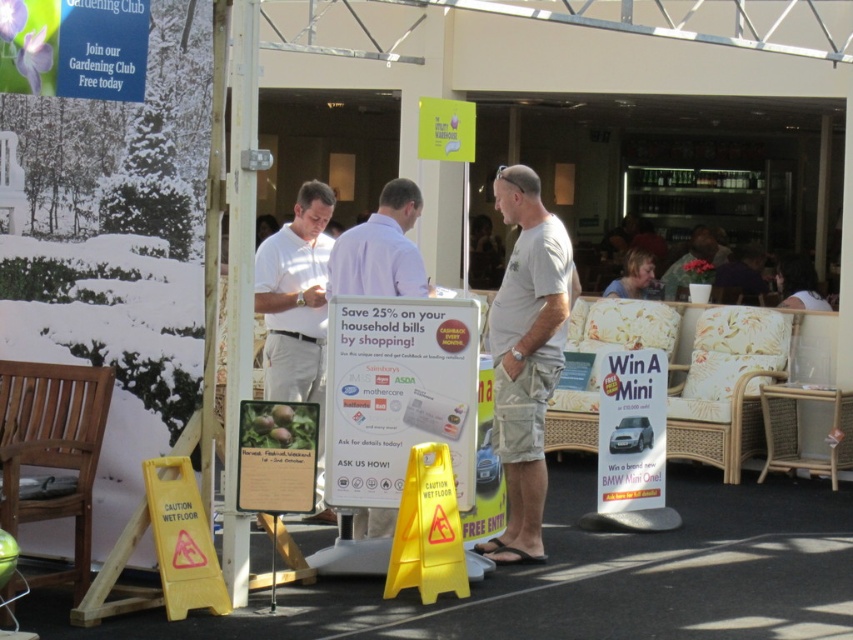
You are standing at the center of the event area and want to locate the white paper sign at center. According to the coordinates provided, where should you look relative to your current position?

The white paper sign at center is located at coordinates point (398, 394), which means it is positioned to the right and slightly above your current position at the center.